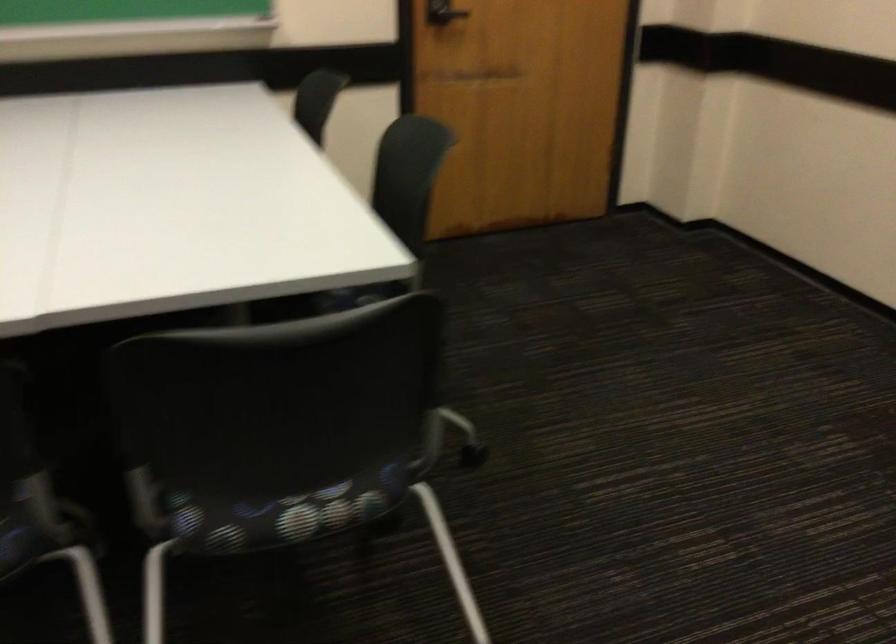
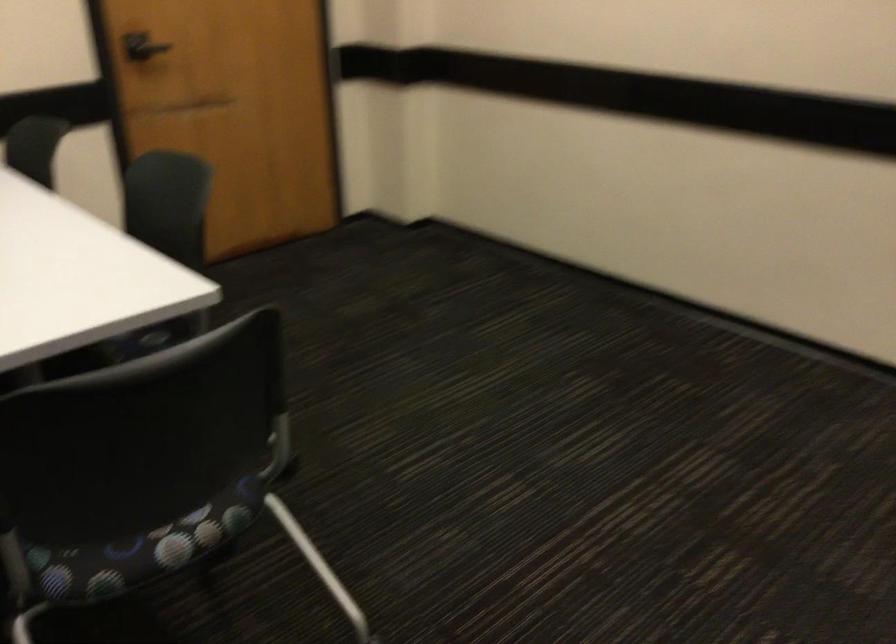
Question: The first image is from the beginning of the video and the second image is from the end. How did the camera likely rotate when shooting the video?

Choices:
 (A) Left
 (B) Right
 (C) Up
 (D) Down

Answer: (B)